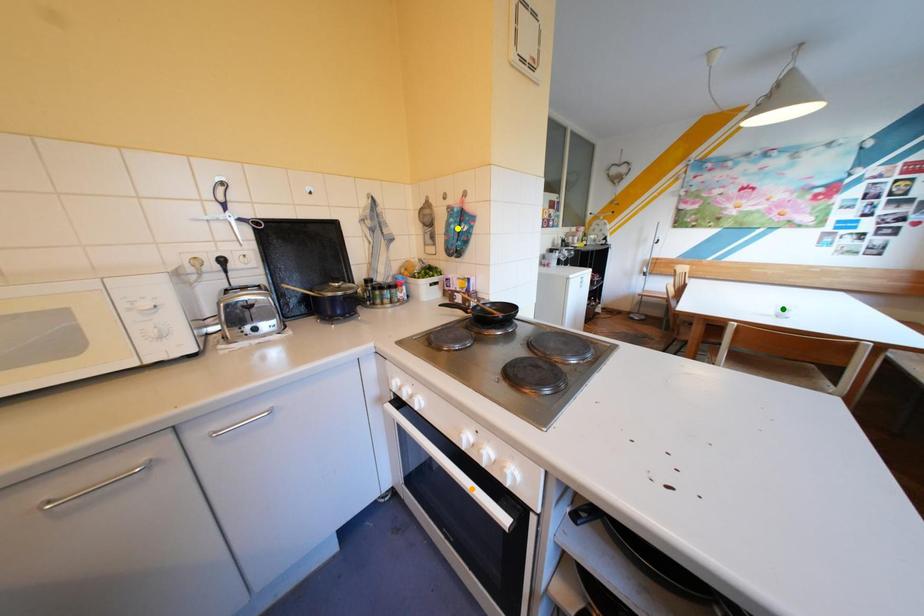
Order these from nearest to farthest:
- green point
- yellow point
- orange point

1. orange point
2. yellow point
3. green point